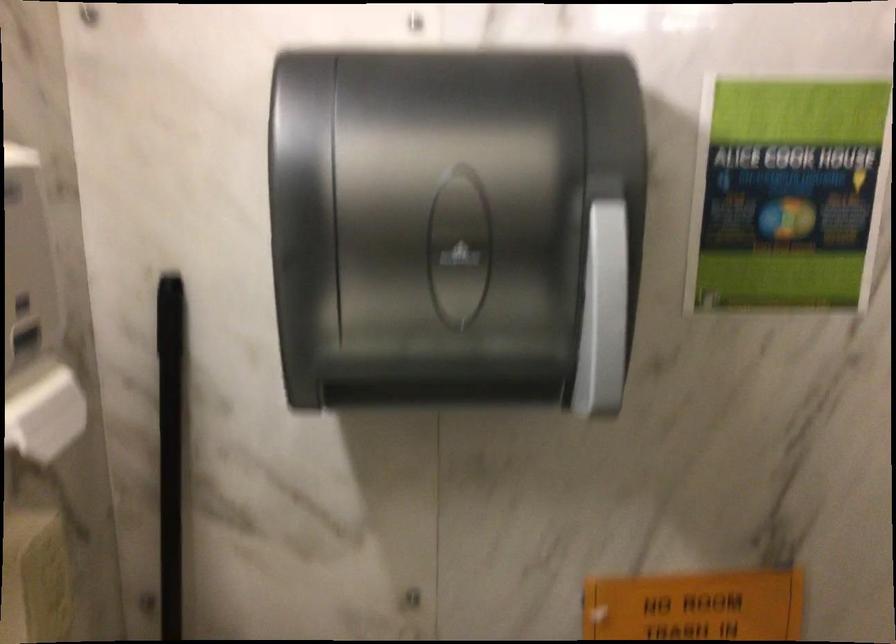
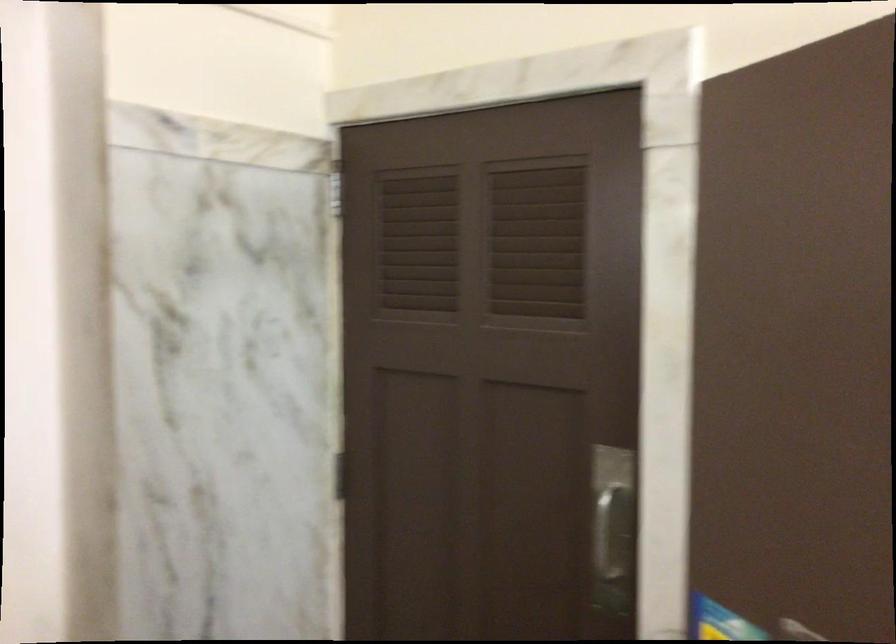
Question: How did the camera likely rotate?

Choices:
 (A) Left
 (B) Right
 (C) Up
 (D) Down

Answer: (B)